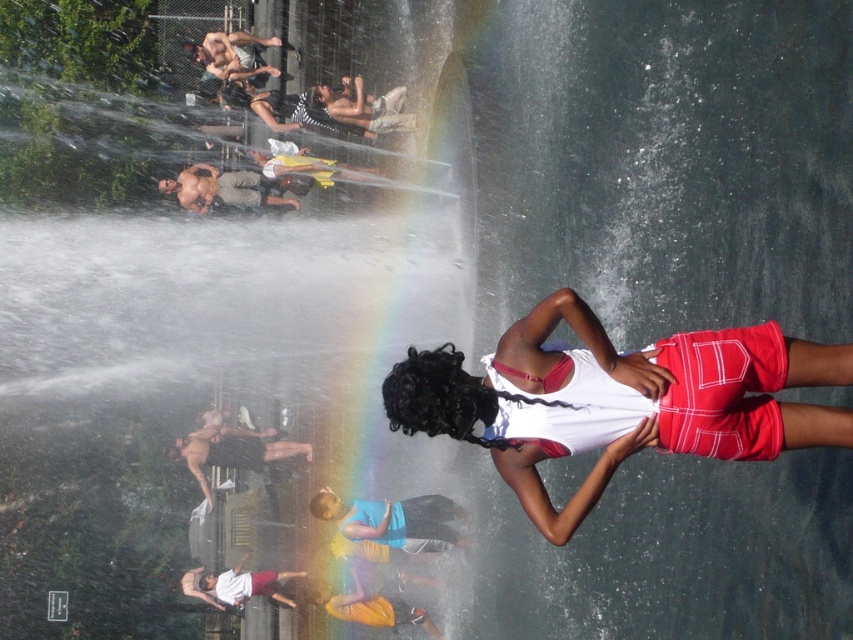
Question: Is white fabric shorts at center below shiny metallic shorts at upper center?

Choices:
 (A) no
 (B) yes

Answer: (B)

Question: Which of the following is the closest to the observer?

Choices:
 (A) tap(457, 428)
 (B) tap(242, 177)
 (C) tap(310, 452)

Answer: (A)

Question: Which point is farther from the camera taking this photo?

Choices:
 (A) (196, 460)
 (B) (218, 198)
 (C) (540, 388)

Answer: (B)

Question: Does white fabric shorts at center have a greater width compared to black fabric shirt at center?

Choices:
 (A) yes
 (B) no

Answer: (B)

Question: Among these objects, which one is nearest to the camera?

Choices:
 (A) white fabric shorts at center
 (B) shiny metallic shorts at upper center

Answer: (A)

Question: Is white fabric shorts at center positioned at the back of black fabric shirt at center?

Choices:
 (A) no
 (B) yes

Answer: (A)